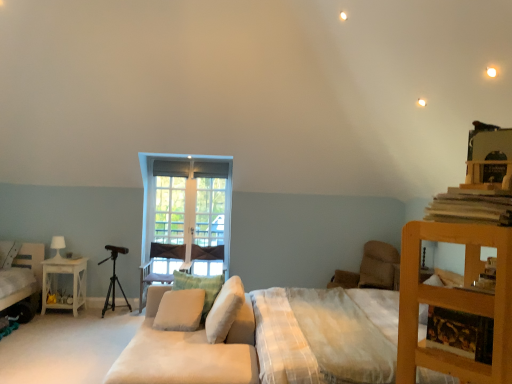
Question: Is wooden tripod at left wider or thinner than white soft cushion at center, the 2th pillow positioned from the left?

Choices:
 (A) thin
 (B) wide

Answer: (A)

Question: From the image's perspective, relative to white soft cushion at center, arranged as the 3th pillow when viewed from the back, is wooden tripod at left above or below?

Choices:
 (A) below
 (B) above

Answer: (A)

Question: Estimate the real-world distances between objects in this image. Which object is closer to the white soft cushion at center, the 4th pillow viewed from the back?

Choices:
 (A) white glossy table lamp at left
 (B) velvet purple armchair at center, which appears as the second armchair when viewed from the right
 (C) beige fabric pillow at center, arranged as the second pillow when viewed from the right
 (D) wooden bookshelf at right
 (E) wooden tripod at left

Answer: (C)

Question: Which object is the farthest from the velvet purple armchair at center, which appears as the second armchair when viewed from the right?

Choices:
 (A) white glossy nightstand at left
 (B) white soft cushion at center, marked as the 4th pillow in a left-to-right arrangement
 (C) white soft cushion at center, which is the 3th pillow from right to left
 (D) beige fabric pillow at center, the third pillow positioned from the front
 (E) beige fabric armchair at center-right, which is the first armchair in right-to-left order

Answer: (B)